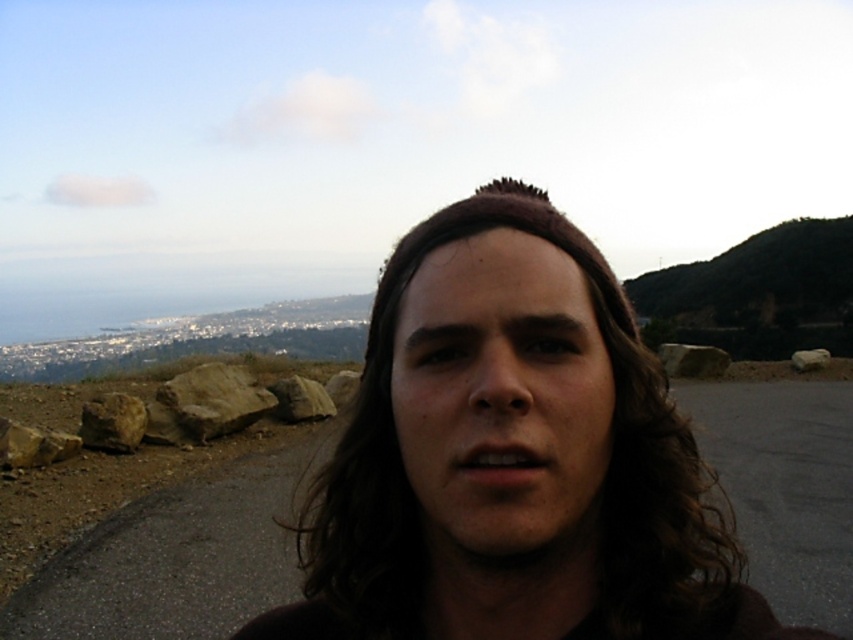
Does brown matte hair at center have a smaller size compared to gray rough rock at right?

Yes, brown matte hair at center is smaller than gray rough rock at right.

Does point (343, 564) come in front of point (675, 371)?

Yes, point (343, 564) is closer to viewer.

Is point (548, 236) more distant than point (694, 362)?

No, (548, 236) is closer to viewer.

This screenshot has width=853, height=640. What are the coordinates of `brown matte hair at center` in the screenshot? It's located at (544, 483).

Can you confirm if dirt road at center is wider than gray rough rock at right?

Indeed, dirt road at center has a greater width compared to gray rough rock at right.

Measure the distance between dirt road at center and gray rough rock at right.

A distance of 7.70 meters exists between dirt road at center and gray rough rock at right.

Is point (28, 634) farther from camera compared to point (714, 358)?

That is False.

Find the location of a particular element. The width and height of the screenshot is (853, 640). dirt road at center is located at coordinates (173, 563).

Between brown matte hair at center and dirt road at center, which one appears on the right side from the viewer's perspective?

Positioned to the right is dirt road at center.

In order to click on brown matte hair at center in this screenshot , I will do `click(544, 483)`.

Describe the element at coordinates (544, 483) in the screenshot. The height and width of the screenshot is (640, 853). I see `brown matte hair at center` at that location.

Find the location of a particular element. The width and height of the screenshot is (853, 640). brown matte hair at center is located at coordinates (544, 483).